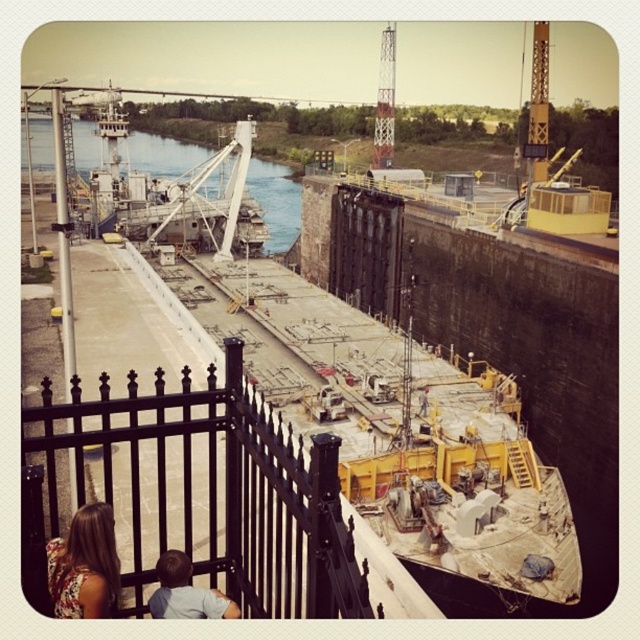
You are standing at the fence observing the lock chamber. You notice two features in the lower left corner of your view. One is the floral fabric dress at lower left and the other is light brown hair at lower left. Which one is positioned higher from the ground?

The floral fabric dress at lower left is located above light brown hair at lower left, so the floral fabric dress at lower left is positioned higher from the ground.

In the scene shown: You are standing at the center of the lock chamber and want to exit through the black wrought iron fence at lower left. In which direction should you walk to reach it?

The black wrought iron fence at lower left is located at point (216, 492), so you should walk towards the lower left direction to reach it.

You are standing at the black wrought iron fence observing the lock chamber. There are two points marked in the scene, point [84,552] and point [168,600]. Which point is closer to you?

Point [84,552] is in front of point [168,600], so it is closer to you.